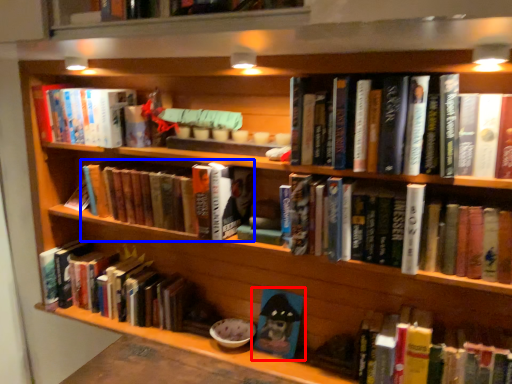
Question: Which object appears farthest to the camera in this image, book (highlighted by a red box) or book (highlighted by a blue box)?

Choices:
 (A) book
 (B) book

Answer: (A)